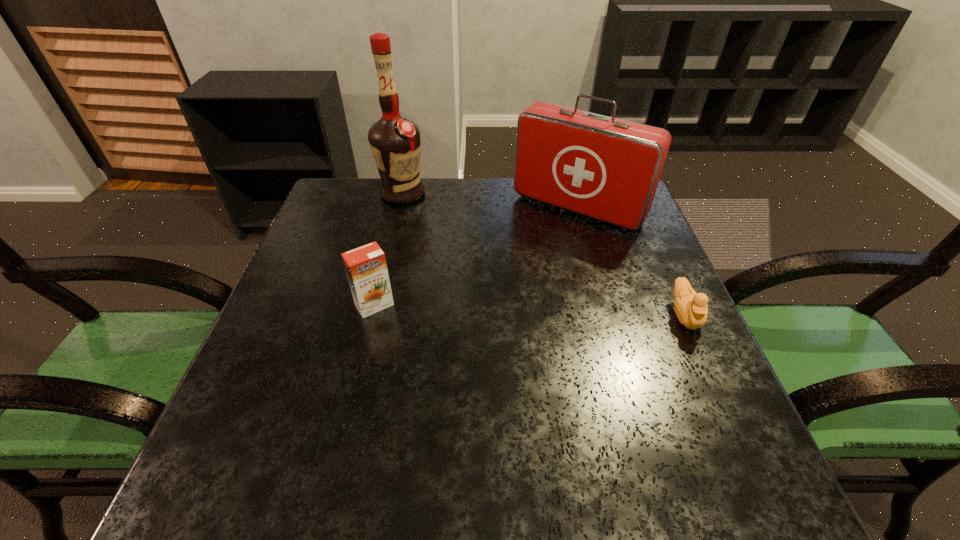
This screenshot has width=960, height=540. I want to click on vacant space at the near edge of the desktop, so click(525, 401).

The width and height of the screenshot is (960, 540). In order to click on vacant position at the left edge of the desktop in this screenshot , I will do `click(351, 242)`.

Find the location of a particular element. The width and height of the screenshot is (960, 540). free region at the right edge of the desktop is located at coordinates point(645,343).

Locate an element on the screen. The width and height of the screenshot is (960, 540). vacant space at the far left corner of the desktop is located at coordinates (342, 184).

In the image, there is a desktop. Where is `free space at the near right corner`? The image size is (960, 540). free space at the near right corner is located at coordinates (718, 420).

Locate an element on the screen. The image size is (960, 540). vacant area between the tallest object and the duckling is located at coordinates (543, 254).

Identify the location of vacant point located between the second shortest object and the shortest object. Image resolution: width=960 pixels, height=540 pixels. (529, 310).

Find the location of `vacant region between the liquor and the third tallest object`. vacant region between the liquor and the third tallest object is located at coordinates (389, 249).

Find the location of a particular element. free area in between the duckling and the tallest object is located at coordinates (543, 254).

This screenshot has height=540, width=960. Identify the location of free space between the shortest object and the third tallest object. (529, 310).